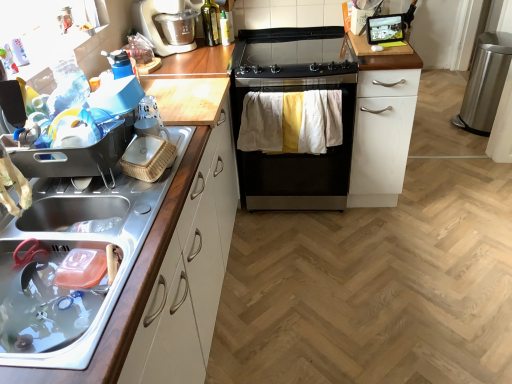
Question: Is the depth of black stainless steel stove at center less than that of metallic sink at left, positioned as the second cabinetry in back-to-front order?

Choices:
 (A) no
 (B) yes

Answer: (A)

Question: Is black stainless steel stove at center far from metallic sink at left, which appears as the 1th cabinetry when viewed from the left?

Choices:
 (A) no
 (B) yes

Answer: (A)

Question: From a real-world perspective, does black stainless steel stove at center sit lower than metallic sink at left, the first cabinetry viewed from the front?

Choices:
 (A) no
 (B) yes

Answer: (B)

Question: Is black stainless steel stove at center not within metallic sink at left, positioned as the second cabinetry in back-to-front order?

Choices:
 (A) yes
 (B) no

Answer: (A)

Question: From a real-world perspective, is black stainless steel stove at center positioned over metallic sink at left, the 2th cabinetry when ordered from right to left, based on gravity?

Choices:
 (A) yes
 (B) no

Answer: (B)

Question: Visually, is white matte cabinet at center-right, placed as the first cabinetry when sorted from back to front, positioned to the left or to the right of metallic sink at left, the 2th cabinetry when ordered from right to left?

Choices:
 (A) left
 (B) right

Answer: (B)

Question: Is point [365, 205] positioned closer to the camera than point [179, 167]?

Choices:
 (A) farther
 (B) closer

Answer: (A)

Question: Looking at the image, does white matte cabinet at center-right, the 2th cabinetry from the left, seem bigger or smaller compared to metallic sink at left, the 2th cabinetry when ordered from right to left?

Choices:
 (A) big
 (B) small

Answer: (A)

Question: In terms of height, does white matte cabinet at center-right, the 2th cabinetry in the front-to-back sequence, look taller or shorter compared to metallic sink at left, positioned as the second cabinetry in back-to-front order?

Choices:
 (A) tall
 (B) short

Answer: (A)

Question: From a real-world perspective, relative to translucent plastic spray bottle at upper center, the 2th bottle positioned from the left, is black stainless steel stove at center vertically above or below?

Choices:
 (A) above
 (B) below

Answer: (B)

Question: In terms of size, does black stainless steel stove at center appear bigger or smaller than translucent plastic spray bottle at upper center, the 2th bottle positioned from the left?

Choices:
 (A) big
 (B) small

Answer: (A)

Question: Do you think black stainless steel stove at center is within translucent plastic spray bottle at upper center, placed as the 1th bottle when sorted from right to left, or outside of it?

Choices:
 (A) inside
 (B) outside

Answer: (B)

Question: Is black stainless steel stove at center in front of or behind translucent plastic spray bottle at upper center, the 2th bottle positioned from the left, in the image?

Choices:
 (A) front
 (B) behind

Answer: (A)

Question: Would you say metallic sink at left, the 2th cabinetry when ordered from right to left, is to the left or to the right of satin silver coffee machine at upper left in the picture?

Choices:
 (A) right
 (B) left

Answer: (B)

Question: From a real-world perspective, relative to satin silver coffee machine at upper left, is metallic sink at left, the 2th cabinetry when ordered from right to left, vertically above or below?

Choices:
 (A) above
 (B) below

Answer: (B)